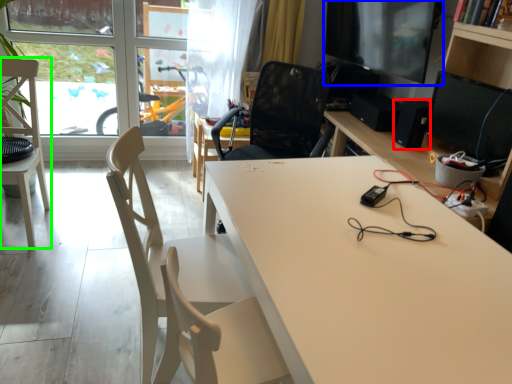
Question: Which is farther away from speaker (highlighted by a red box)? computer monitor (highlighted by a blue box) or chair (highlighted by a green box)?

Choices:
 (A) computer monitor
 (B) chair

Answer: (B)